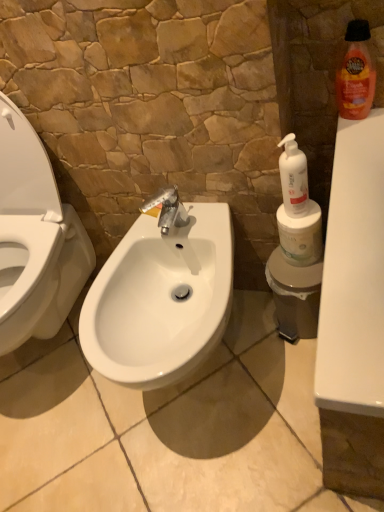
This screenshot has width=384, height=512. Find the location of `vacant location below white glossy bidet at center (from a real-world perspective)`. vacant location below white glossy bidet at center (from a real-world perspective) is located at coordinates (52, 361).